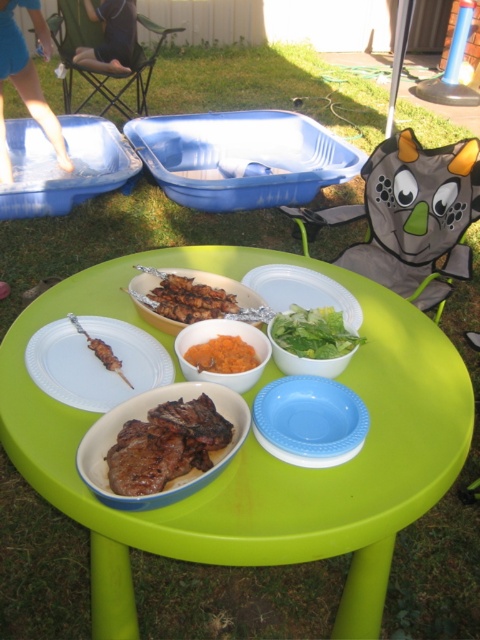
Question: Which point is farther from the camera taking this photo?

Choices:
 (A) (266, 445)
 (B) (274, 326)

Answer: (B)

Question: Considering the relative positions of orange matte bowl at center and orange smoothie at center in the image provided, where is orange matte bowl at center located with respect to orange smoothie at center?

Choices:
 (A) below
 (B) above

Answer: (A)

Question: Is green plastic table at center positioned in front of blue plastic plate at center?

Choices:
 (A) no
 (B) yes

Answer: (B)

Question: Can you confirm if green plastic table at center is thinner than blue plastic plate at center?

Choices:
 (A) no
 (B) yes

Answer: (A)

Question: Which point is closer to the camera?

Choices:
 (A) (218, 324)
 (B) (194, 296)
 (C) (295, 324)

Answer: (C)

Question: Which point is closer to the camera?

Choices:
 (A) brown matte skewers at center
 (B) orange matte bowl at center
 (C) matte blue bowl at center

Answer: (C)